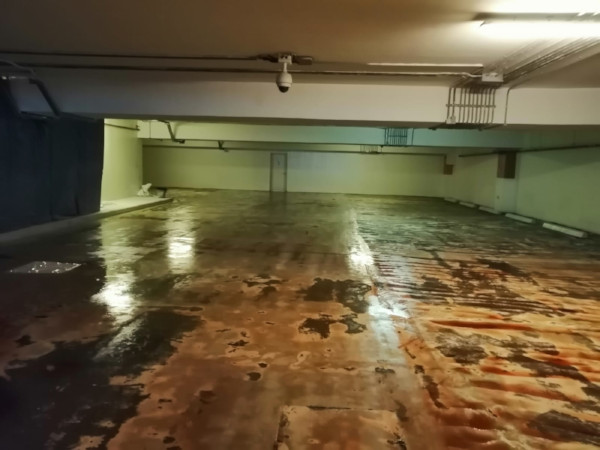
Identify the location of white light. (365, 253), (168, 243), (116, 297).